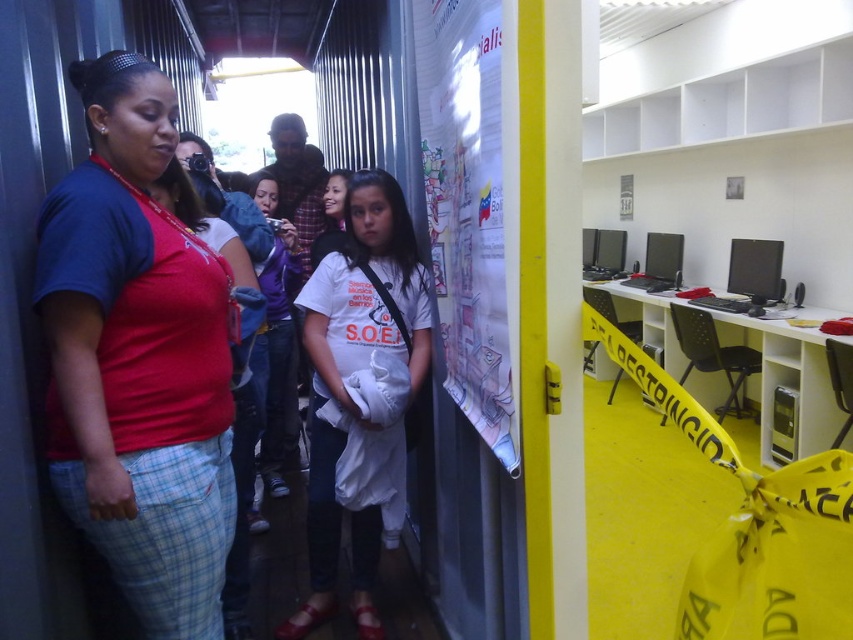
Is point (360, 211) positioned after point (654, 257)?

No.

Based on the photo, is white cotton shirt at center below black glossy monitor at center?

Indeed, white cotton shirt at center is positioned under black glossy monitor at center.

What are the coordinates of `white cotton shirt at center` in the screenshot? It's located at (361, 392).

Is point (345, 317) less distant than point (451, 272)?

That is False.

Does white cotton shirt at center lie in front of white paper poster at center?

No, it is not.

The image size is (853, 640). Describe the element at coordinates (361, 392) in the screenshot. I see `white cotton shirt at center` at that location.

Locate an element on the screen. The width and height of the screenshot is (853, 640). white cotton shirt at center is located at coordinates (361, 392).

Can you confirm if white cotton shirt at center is smaller than purple fleece jacket at center?

Yes.

Between white cotton shirt at center and purple fleece jacket at center, which one is positioned higher?

purple fleece jacket at center is above.

Does point (387, 346) come farther from viewer compared to point (277, 365)?

No, (387, 346) is closer to viewer.

Where is `white cotton shirt at center`? white cotton shirt at center is located at coordinates (361, 392).